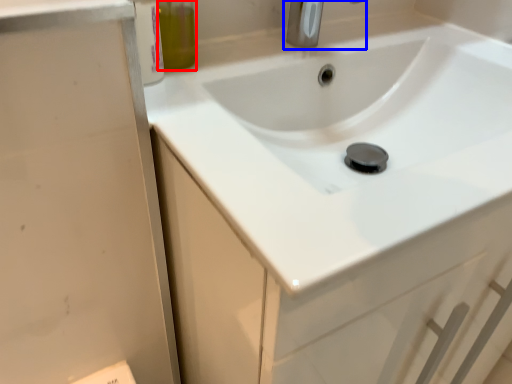
Question: Which point is closer to the camera, olive oil (highlighted by a red box) or tap (highlighted by a blue box)?

Choices:
 (A) olive oil
 (B) tap

Answer: (A)